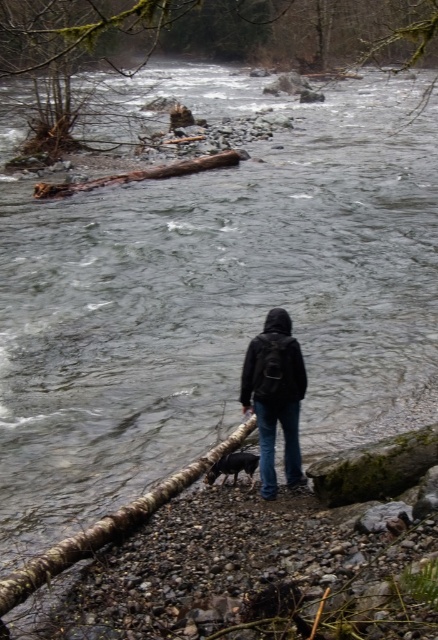
Question: Is black matte jacket at center above brown rough log at upper center?

Choices:
 (A) yes
 (B) no

Answer: (B)

Question: Which point is farther to the camera?

Choices:
 (A) (24, 595)
 (B) (285, 378)

Answer: (B)

Question: Can you confirm if green mossy branch at upper center is positioned to the right of black matte jacket at center?

Choices:
 (A) no
 (B) yes

Answer: (B)

Question: Which object appears farthest from the camera in this image?

Choices:
 (A) brown rough log at lower center
 (B) brown rough log at upper center

Answer: (B)

Question: Can you confirm if green mossy branch at upper center is smaller than brown rough log at upper center?

Choices:
 (A) yes
 (B) no

Answer: (B)

Question: Among these points, which one is farthest from the camera?

Choices:
 (A) [x=247, y=403]
 (B) [x=64, y=180]

Answer: (B)